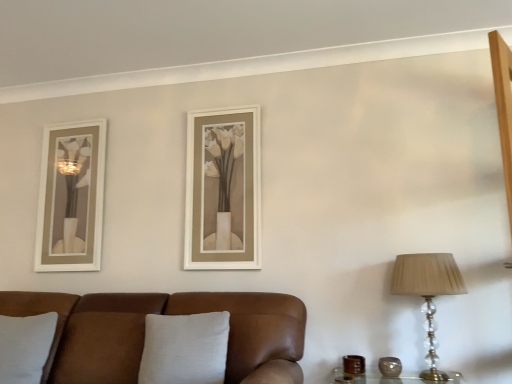
Find the location of a particular element. This screenshot has width=512, height=384. white linen pillow at center, the 2th pillow when ordered from left to right is located at coordinates (185, 348).

This screenshot has width=512, height=384. Find the location of `brown leather candle holder at lower right, positioned as the 2th candle holder in right-to-left order`. brown leather candle holder at lower right, positioned as the 2th candle holder in right-to-left order is located at coordinates (354, 364).

Describe the element at coordinates (354, 364) in the screenshot. I see `brown leather candle holder at lower right, positioned as the 2th candle holder in right-to-left order` at that location.

I want to click on brown textured vase at right, marked as the first candle holder in a right-to-left arrangement, so click(x=390, y=367).

This screenshot has width=512, height=384. Describe the element at coordinates (25, 346) in the screenshot. I see `gray fabric pillow at lower left, marked as the 1th pillow in a left-to-right arrangement` at that location.

Locate an element on the screen. Image resolution: width=512 pixels, height=384 pixels. brown leather couch at lower left is located at coordinates (165, 314).

Does brown textured vase at right, the second candle holder in the left-to-right sequence, have a larger size compared to gray fabric pillow at lower left, marked as the 1th pillow in a left-to-right arrangement?

No.

How different are the orientations of brown textured vase at right, the second candle holder in the left-to-right sequence, and gray fabric pillow at lower left, the second pillow viewed from the right, in degrees?

0.0037 degrees separate the facing orientations of brown textured vase at right, the second candle holder in the left-to-right sequence, and gray fabric pillow at lower left, the second pillow viewed from the right.

Consider the image. Is brown textured vase at right, marked as the first candle holder in a right-to-left arrangement, far from gray fabric pillow at lower left, the second pillow viewed from the right?

That's right, there is a large distance between brown textured vase at right, marked as the first candle holder in a right-to-left arrangement, and gray fabric pillow at lower left, the second pillow viewed from the right.

Is brown textured vase at right, the second candle holder in the left-to-right sequence, situated inside gray fabric pillow at lower left, the second pillow viewed from the right, or outside?

brown textured vase at right, the second candle holder in the left-to-right sequence, is located beyond the bounds of gray fabric pillow at lower left, the second pillow viewed from the right.

Is brown leather couch at lower left looking in the opposite direction of translucent crystal table lamp at right?

No, brown leather couch at lower left is not facing away from translucent crystal table lamp at right.

Which is in front, brown leather couch at lower left or translucent crystal table lamp at right?

brown leather couch at lower left is closer to the camera.

Considering the relative sizes of brown leather couch at lower left and translucent crystal table lamp at right in the image provided, is brown leather couch at lower left smaller than translucent crystal table lamp at right?

No.

Can you confirm if gray fabric pillow at lower left, marked as the 1th pillow in a left-to-right arrangement, is positioned to the right of brown leather couch at lower left?

No.

Consider the image. Who is taller, gray fabric pillow at lower left, the second pillow viewed from the right, or brown leather couch at lower left?

With more height is brown leather couch at lower left.

Are gray fabric pillow at lower left, marked as the 1th pillow in a left-to-right arrangement, and brown leather couch at lower left far apart?

No, gray fabric pillow at lower left, marked as the 1th pillow in a left-to-right arrangement, is not far from brown leather couch at lower left.

Based on the photo, does white linen pillow at center, the 2th pillow when ordered from left to right, have a smaller size compared to brown leather candle holder at lower right, acting as the 1th candle holder starting from the left?

No, white linen pillow at center, the 2th pillow when ordered from left to right, is not smaller than brown leather candle holder at lower right, acting as the 1th candle holder starting from the left.

Is white linen pillow at center, the 2th pillow when ordered from left to right, beside brown leather candle holder at lower right, acting as the 1th candle holder starting from the left?

No, white linen pillow at center, the 2th pillow when ordered from left to right, is not in contact with brown leather candle holder at lower right, acting as the 1th candle holder starting from the left.

Between point (389, 366) and point (359, 366), which one is positioned in front?

Point (389, 366)

From a real-world perspective, is brown textured vase at right, marked as the first candle holder in a right-to-left arrangement, physically located above or below brown leather candle holder at lower right, positioned as the 2th candle holder in right-to-left order?

Clearly, from a real-world perspective, brown textured vase at right, marked as the first candle holder in a right-to-left arrangement, is above brown leather candle holder at lower right, positioned as the 2th candle holder in right-to-left order.

Image resolution: width=512 pixels, height=384 pixels. Identify the location of candle holder in front of the brown leather candle holder at lower right, positioned as the 2th candle holder in right-to-left order. (390, 367).

Is brown leather candle holder at lower right, acting as the 1th candle holder starting from the left, completely or partially inside brown textured vase at right, the second candle holder in the left-to-right sequence?

No, brown leather candle holder at lower right, acting as the 1th candle holder starting from the left, is not a part of brown textured vase at right, the second candle holder in the left-to-right sequence.

From a real-world perspective, which is physically below, gray fabric pillow at lower left, marked as the 1th pillow in a left-to-right arrangement, or brown leather candle holder at lower right, acting as the 1th candle holder starting from the left?

brown leather candle holder at lower right, acting as the 1th candle holder starting from the left.

Between gray fabric pillow at lower left, marked as the 1th pillow in a left-to-right arrangement, and brown leather candle holder at lower right, acting as the 1th candle holder starting from the left, which one has less height?

Standing shorter between the two is brown leather candle holder at lower right, acting as the 1th candle holder starting from the left.

How many degrees apart are the facing directions of gray fabric pillow at lower left, the second pillow viewed from the right, and brown leather candle holder at lower right, positioned as the 2th candle holder in right-to-left order?

The angular difference between gray fabric pillow at lower left, the second pillow viewed from the right, and brown leather candle holder at lower right, positioned as the 2th candle holder in right-to-left order, is 0.00183 degrees.

In terms of width, does gray fabric pillow at lower left, marked as the 1th pillow in a left-to-right arrangement, look wider or thinner when compared to brown leather candle holder at lower right, acting as the 1th candle holder starting from the left?

Clearly, gray fabric pillow at lower left, marked as the 1th pillow in a left-to-right arrangement, has more width compared to brown leather candle holder at lower right, acting as the 1th candle holder starting from the left.

I want to click on studio couch above the brown leather candle holder at lower right, acting as the 1th candle holder starting from the left (from a real-world perspective), so click(165, 314).

Can you confirm if brown leather couch at lower left is smaller than brown leather candle holder at lower right, positioned as the 2th candle holder in right-to-left order?

No, brown leather couch at lower left is not smaller than brown leather candle holder at lower right, positioned as the 2th candle holder in right-to-left order.

From the image's perspective, is brown leather couch at lower left located above or below brown leather candle holder at lower right, positioned as the 2th candle holder in right-to-left order?

From the image's perspective, brown leather couch at lower left appears above brown leather candle holder at lower right, positioned as the 2th candle holder in right-to-left order.

From a real-world perspective, is brown leather couch at lower left physically above brown leather candle holder at lower right, positioned as the 2th candle holder in right-to-left order?

Correct, in the physical world, brown leather couch at lower left is higher than brown leather candle holder at lower right, positioned as the 2th candle holder in right-to-left order.

What are the coordinates of `the 2nd candle holder counting from the right of the gray fabric pillow at lower left, marked as the 1th pillow in a left-to-right arrangement` in the screenshot? It's located at (390, 367).

There is a brown leather couch at lower left. Identify the location of table lamp above it (from a real-world perspective). The width and height of the screenshot is (512, 384). (428, 293).

Based on their spatial positions, is brown textured vase at right, marked as the first candle holder in a right-to-left arrangement, or brown leather candle holder at lower right, acting as the 1th candle holder starting from the left, closer to translucent crystal table lamp at right?

brown textured vase at right, marked as the first candle holder in a right-to-left arrangement, lies closer to translucent crystal table lamp at right than the other object.

Which object lies nearer to the anchor point translucent crystal table lamp at right, white linen pillow at center, the 2th pillow when ordered from left to right, or gray fabric pillow at lower left, the second pillow viewed from the right?

white linen pillow at center, the 2th pillow when ordered from left to right, is positioned closer to the anchor translucent crystal table lamp at right.

Looking at the image, which one is located closer to brown textured vase at right, marked as the first candle holder in a right-to-left arrangement, brown leather couch at lower left or brown leather candle holder at lower right, positioned as the 2th candle holder in right-to-left order?

Based on the image, brown leather candle holder at lower right, positioned as the 2th candle holder in right-to-left order, appears to be nearer to brown textured vase at right, marked as the first candle holder in a right-to-left arrangement.

Estimate the real-world distances between objects in this image. Which object is closer to brown textured vase at right, the second candle holder in the left-to-right sequence, brown leather couch at lower left or gray fabric pillow at lower left, marked as the 1th pillow in a left-to-right arrangement?

brown leather couch at lower left lies closer to brown textured vase at right, the second candle holder in the left-to-right sequence, than the other object.

Which object lies further to the anchor point white linen pillow at center, positioned as the 1th pillow in right-to-left order, translucent crystal table lamp at right or gray fabric pillow at lower left, the second pillow viewed from the right?

translucent crystal table lamp at right lies further to white linen pillow at center, positioned as the 1th pillow in right-to-left order, than the other object.

In the scene shown: Looking at the image, which one is located closer to translucent crystal table lamp at right, gray fabric pillow at lower left, the second pillow viewed from the right, or white linen pillow at center, positioned as the 1th pillow in right-to-left order?

white linen pillow at center, positioned as the 1th pillow in right-to-left order.

Based on the photo, considering their positions, is translucent crystal table lamp at right positioned further to brown leather candle holder at lower right, acting as the 1th candle holder starting from the left, than brown leather couch at lower left?

brown leather couch at lower left lies further to brown leather candle holder at lower right, acting as the 1th candle holder starting from the left, than the other object.

Based on the photo, when comparing their distances from brown textured vase at right, the second candle holder in the left-to-right sequence, does gray fabric pillow at lower left, marked as the 1th pillow in a left-to-right arrangement, or white linen pillow at center, positioned as the 1th pillow in right-to-left order, seem closer?

Among the two, white linen pillow at center, positioned as the 1th pillow in right-to-left order, is located nearer to brown textured vase at right, the second candle holder in the left-to-right sequence.

Where is `candle holder between brown leather candle holder at lower right, positioned as the 2th candle holder in right-to-left order, and translucent crystal table lamp at right`? candle holder between brown leather candle holder at lower right, positioned as the 2th candle holder in right-to-left order, and translucent crystal table lamp at right is located at coordinates (390, 367).

Locate an element on the screen. pillow situated between brown leather couch at lower left and brown leather candle holder at lower right, acting as the 1th candle holder starting from the left, from left to right is located at coordinates (185, 348).

Locate an element on the screen. The width and height of the screenshot is (512, 384). candle holder between white linen pillow at center, the 2th pillow when ordered from left to right, and brown textured vase at right, the second candle holder in the left-to-right sequence, from left to right is located at coordinates (354, 364).

Locate an element on the screen. pillow between brown leather couch at lower left and brown textured vase at right, marked as the first candle holder in a right-to-left arrangement, in the horizontal direction is located at coordinates (185, 348).